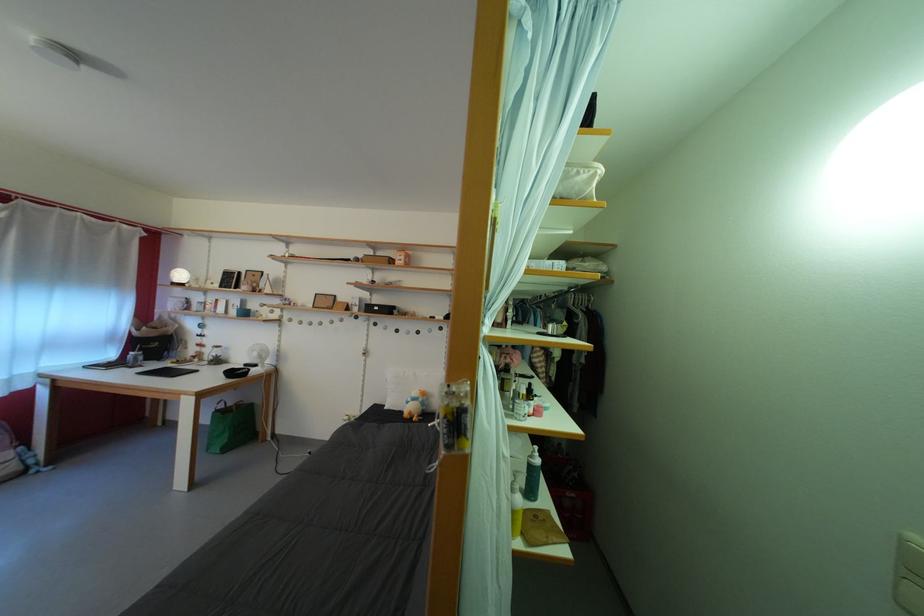
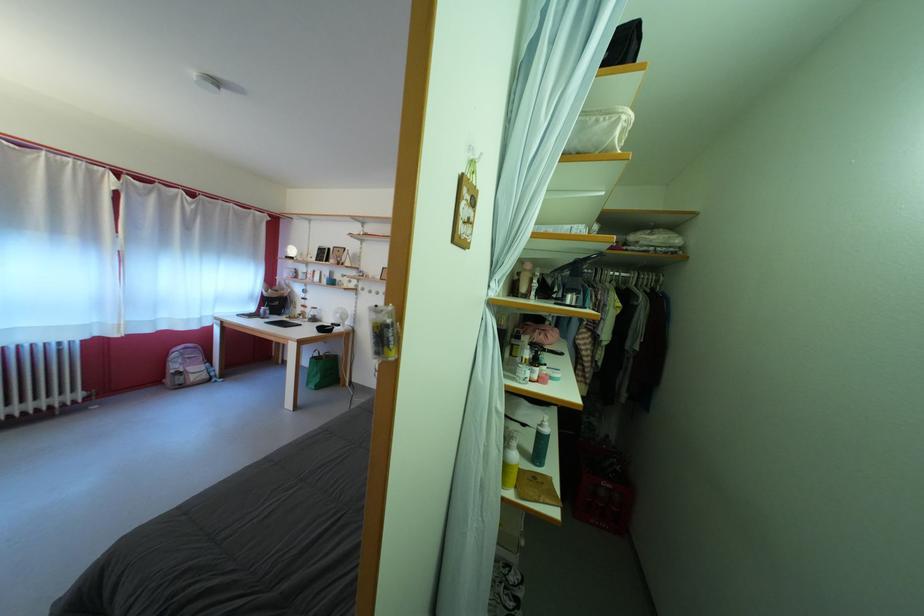
In the second image, find the point that corresponds to [457,428] in the first image.

(383, 339)